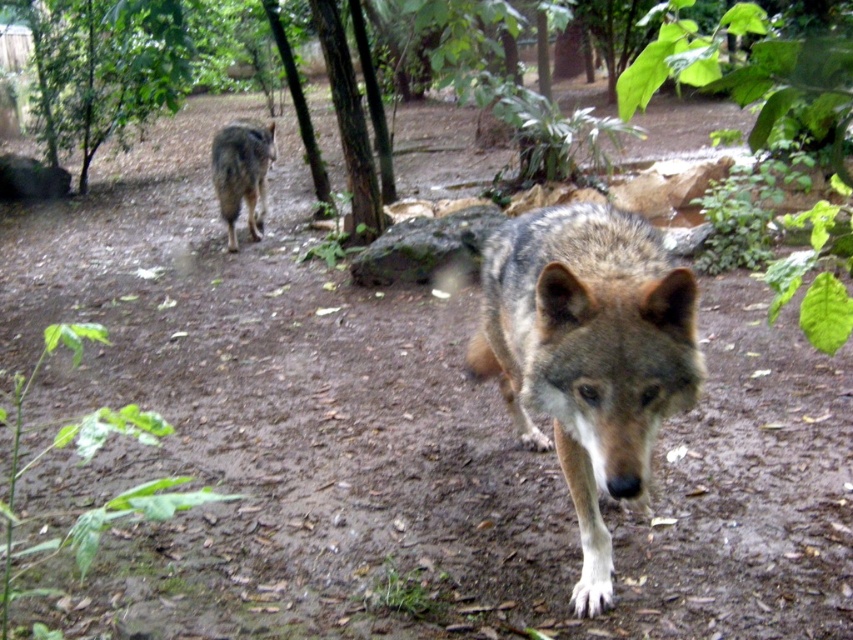
Question: Which point is closer to the camera taking this photo?

Choices:
 (A) (523, 372)
 (B) (242, 161)
 (C) (48, 36)

Answer: (A)

Question: Is green leafy tree at upper left below gray fur wolf at upper left?

Choices:
 (A) yes
 (B) no

Answer: (B)

Question: Among these objects, which one is nearest to the camera?

Choices:
 (A) gray fur wolf at upper left
 (B) green leafy tree at upper left
 (C) gray fur wolf at center

Answer: (C)

Question: Does green leafy tree at upper left have a lesser width compared to gray fur wolf at upper left?

Choices:
 (A) yes
 (B) no

Answer: (B)

Question: Which point is farther to the camera?

Choices:
 (A) gray fur wolf at center
 (B) green leafy tree at upper left
 (C) gray fur wolf at upper left

Answer: (B)

Question: Does gray fur wolf at center appear under green leafy tree at upper left?

Choices:
 (A) yes
 (B) no

Answer: (A)